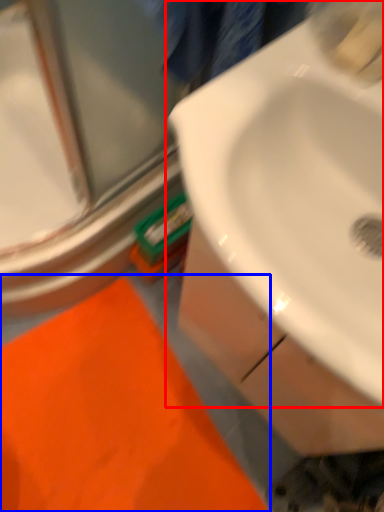
Question: Which of the following is the closest to the observer, sink (highlighted by a red box) or bath mat (highlighted by a blue box)?

Choices:
 (A) sink
 (B) bath mat

Answer: (A)